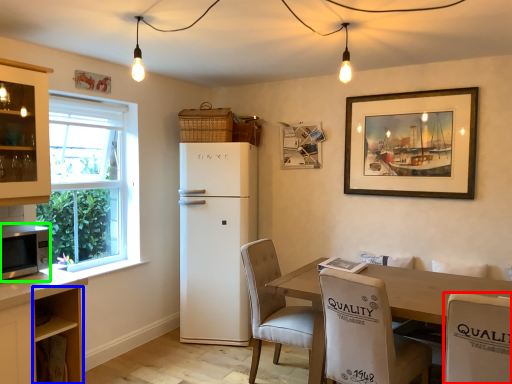
Question: Which object is positioned farthest from chair (highlighted by a red box)? Select from cabinetry (highlighted by a blue box) and microwave oven (highlighted by a green box).

Choices:
 (A) cabinetry
 (B) microwave oven

Answer: (B)